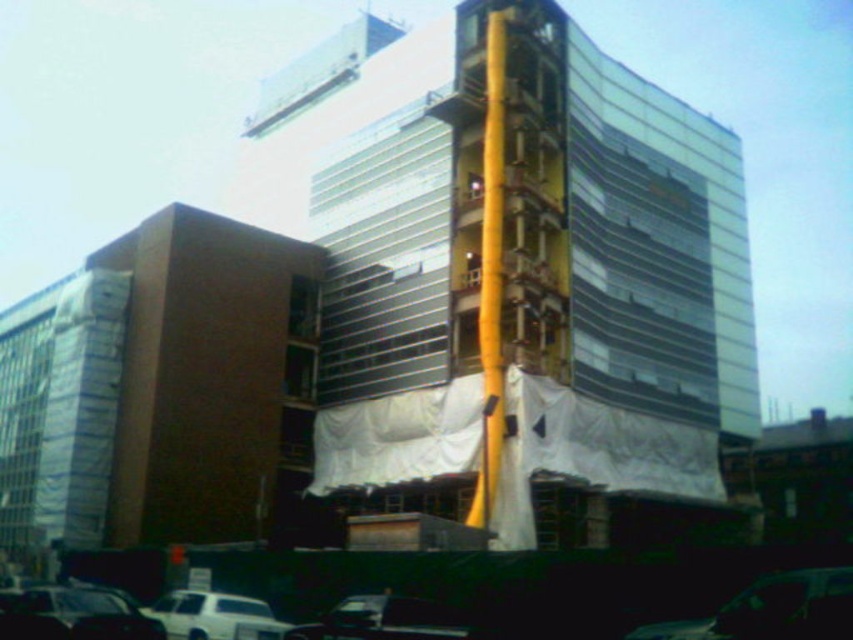
Is yellow wood pole at center positioned in front of shiny black car at center?

No, yellow wood pole at center is further to the viewer.

Is point (480, 253) positioned in front of point (799, 611)?

That is False.

In the scene shown: Who is more forward, (482,216) or (711,621)?

Positioned in front is point (711,621).

This screenshot has width=853, height=640. Find the location of `yellow wood pole at center`. yellow wood pole at center is located at coordinates (491, 272).

Is yellow metallic tower at center taller than shiny black car at center?

Yes, yellow metallic tower at center is taller than shiny black car at center.

The height and width of the screenshot is (640, 853). What do you see at coordinates (531, 275) in the screenshot?
I see `yellow metallic tower at center` at bounding box center [531, 275].

Identify the location of yellow metallic tower at center. (531, 275).

The image size is (853, 640). Describe the element at coordinates (383, 620) in the screenshot. I see `metallic silver car at lower center` at that location.

Measure the distance between point (357, 628) and camera.

Point (357, 628) and camera are 133.27 feet apart from each other.

Who is more forward, (x=328, y=612) or (x=239, y=620)?

Point (x=239, y=620) is in front.

Identify the location of metallic silver car at lower center. (383, 620).